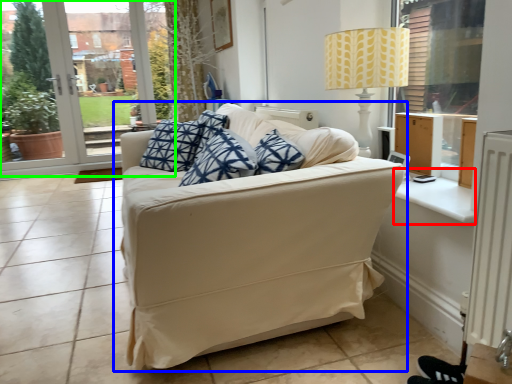
Question: Which object is the farthest from window sill (highlighted by a red box)? Choose among these: studio couch (highlighted by a blue box) or window frame (highlighted by a green box).

Choices:
 (A) studio couch
 (B) window frame

Answer: (B)